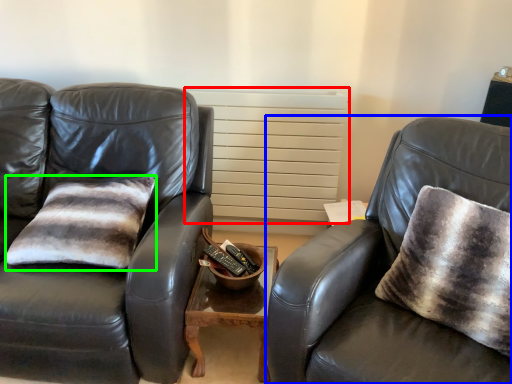
Question: Considering the real-world distances, which object is farthest from radiator (highlighted by a red box)? chair (highlighted by a blue box) or pillow (highlighted by a green box)?

Choices:
 (A) chair
 (B) pillow

Answer: (A)